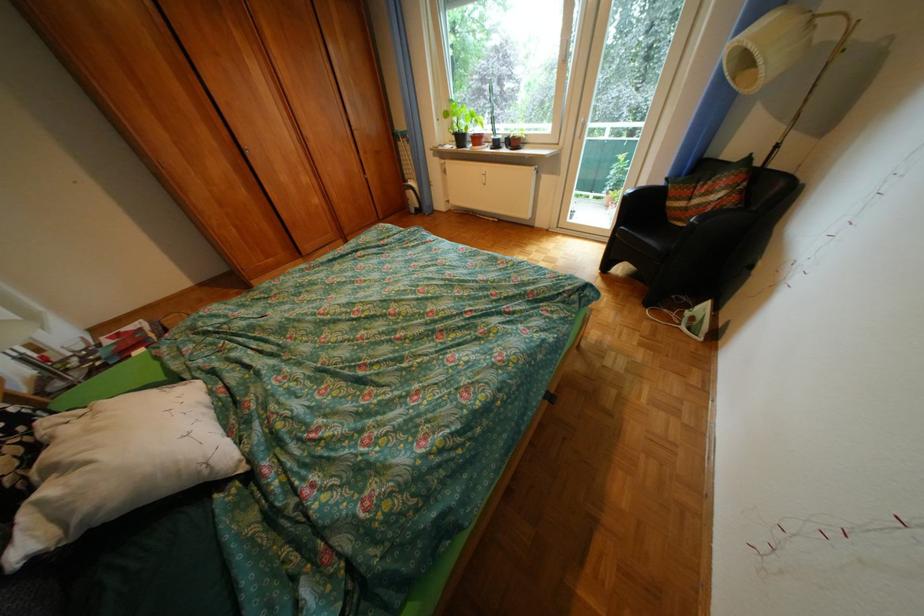
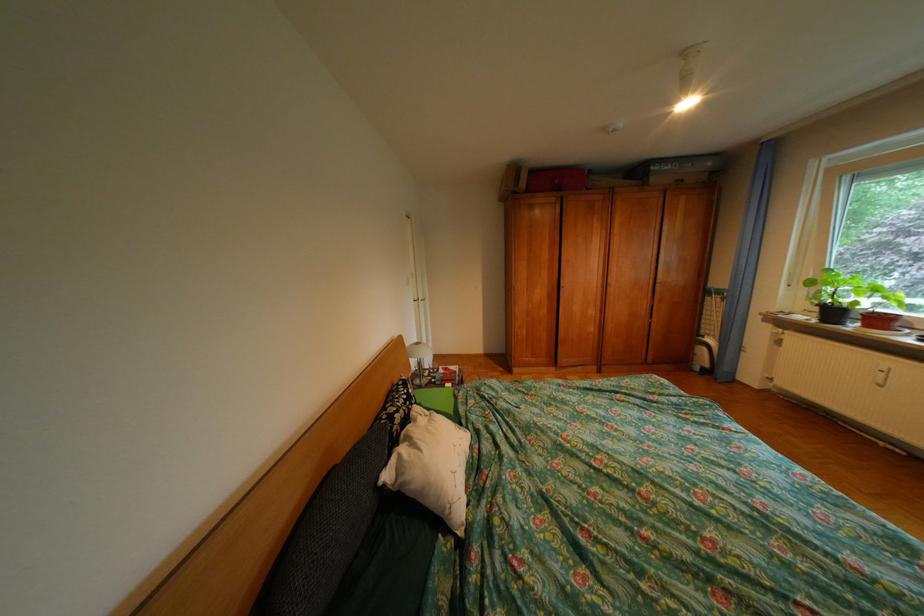
Question: The images are taken continuously from a first-person perspective. In which direction is your viewpoint rotating?

Choices:
 (A) Left
 (B) Right
 (C) Up
 (D) Down

Answer: (A)